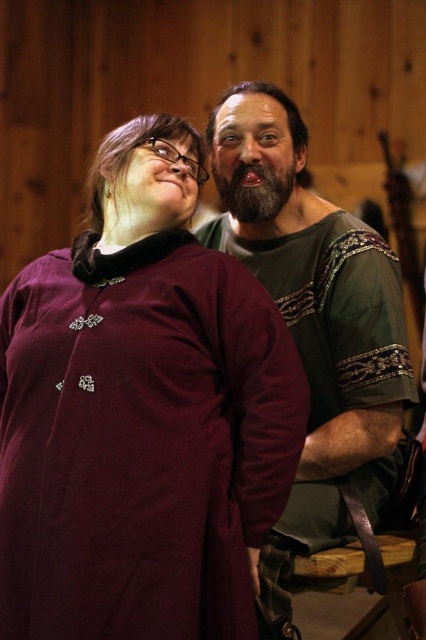
You are a costume designer trying to arrange these two outfits for a photoshoot. The photoshoot requires that the maroon fabric dress at center and the green woven shirt at right must be placed in a way that one is not blocking the other. Based on their current positions, which outfit is currently positioned lower and might need adjustment to avoid blocking?

The maroon fabric dress at center is positioned under the green woven shirt at right, so it is lower and might need adjustment to avoid blocking the green woven shirt at right.

In the image of two people in medieval clothing, where is the maroon fabric dress at center positioned relative to the other person?

The maroon fabric dress at center is located at coordinates approximately 0.648 on the x axis and 0.333 on the y axis.

You are a photographer standing at the camera position. You need to take a closeup shot of the maroon fabric dress at center. Considering the distance, can you get a clear photo without moving closer?

The maroon fabric dress at center is 1.07 meters away from camera. Since this distance is relatively close, you can take a clear closeup photo without needing to move closer.